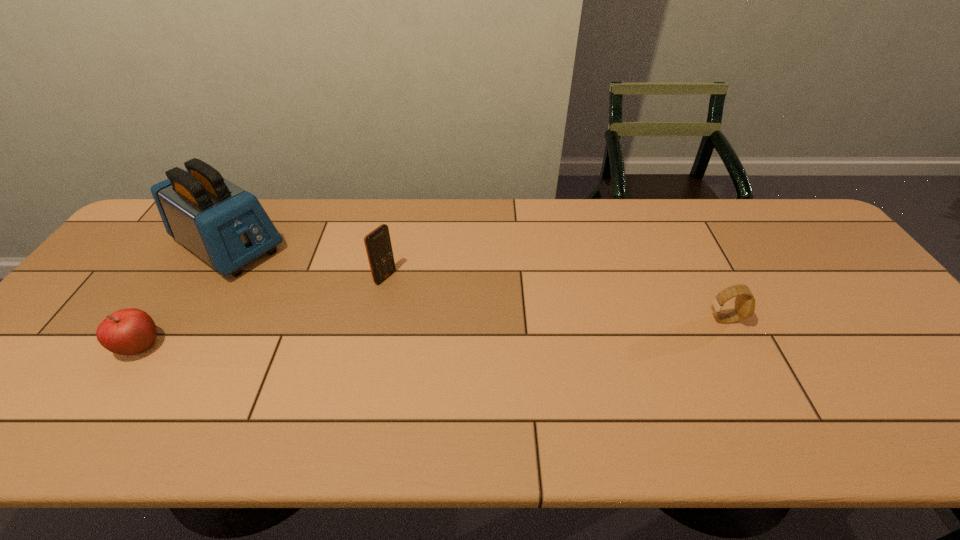
Locate an element on the screen. apple is located at coordinates pyautogui.click(x=130, y=331).

Identify the location of watch. The height and width of the screenshot is (540, 960). (744, 308).

The image size is (960, 540). What are the coordinates of `toaster` in the screenshot? It's located at (226, 226).

Image resolution: width=960 pixels, height=540 pixels. In order to click on cellular telephone in this screenshot , I will do `click(378, 246)`.

Find the location of a particular element. This screenshot has width=960, height=540. the second object from right to left is located at coordinates click(378, 246).

Find the location of a particular element. The width and height of the screenshot is (960, 540). vacant space located on the back of the apple is located at coordinates (178, 291).

Where is `vacant space located 0.100m on the face of the rightmost object`? Image resolution: width=960 pixels, height=540 pixels. vacant space located 0.100m on the face of the rightmost object is located at coordinates (778, 319).

You are a GUI agent. You are given a task and a screenshot of the screen. Output one action in this format:
    pyautogui.click(x=<x>, y=<y>)
    Task: Click on the free space located on the front-facing side of the toaster
    The image size is (960, 540).
    Given the screenshot: What is the action you would take?
    pyautogui.click(x=357, y=332)

Find the location of a particular element. Image resolution: width=960 pixels, height=540 pixels. vacant position located 0.150m on the front-facing side of the toaster is located at coordinates (299, 291).

I want to click on free space located 0.050m on the front-facing side of the toaster, so click(x=276, y=275).